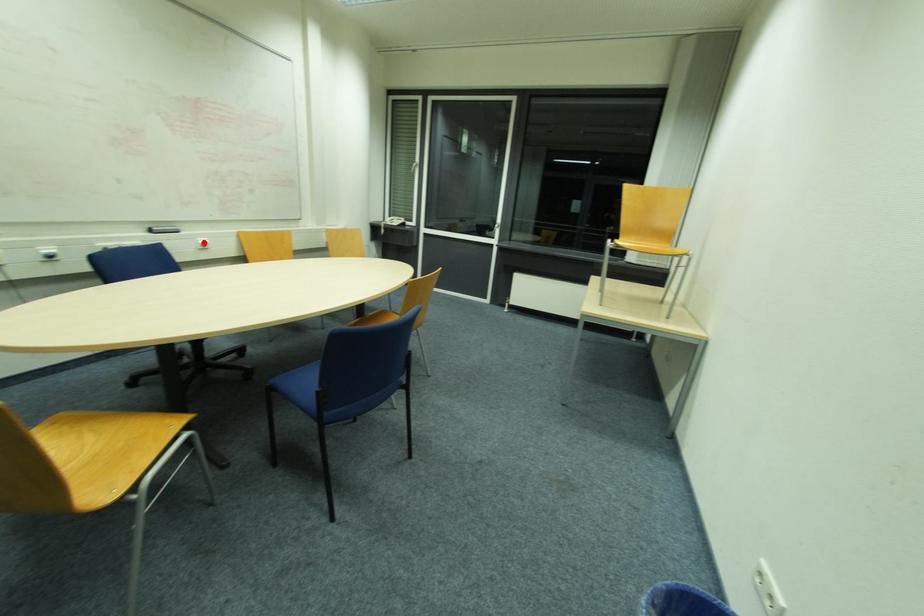
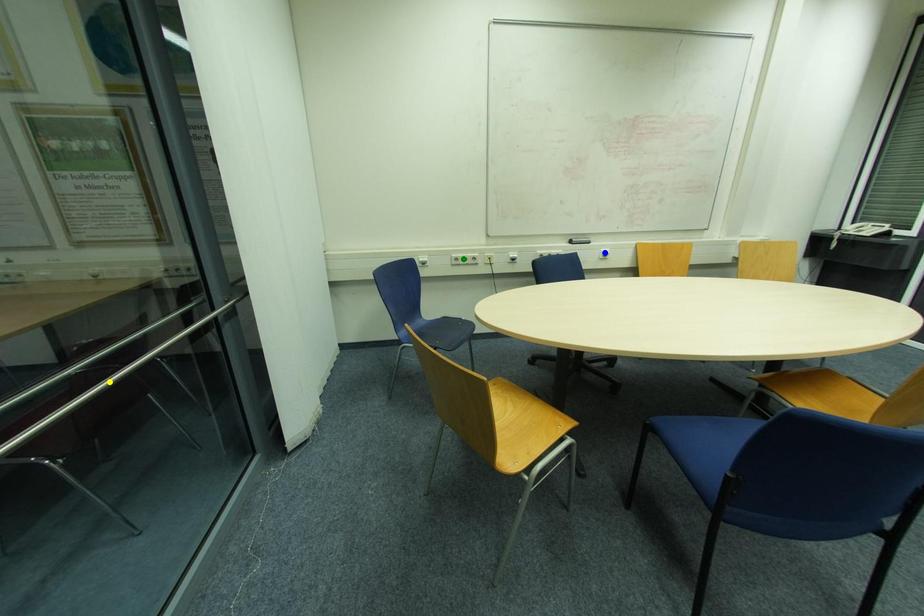
Question: I am providing you with two images of the same scene from different viewpoints. A red point is marked on the first image. You are given multiple points on the second image. In image 2, which mark is for the same physical point as the one in image 1?

Choices:
 (A) blue point
 (B) yellow point
 (C) green point

Answer: (A)